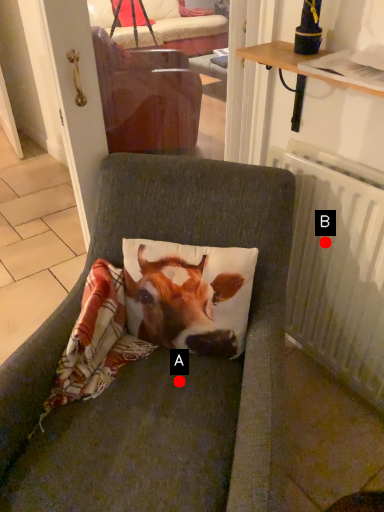
Question: Two points are circled on the image, labeled by A and B beside each circle. Among these points, which one is nearest to the camera?

Choices:
 (A) A is closer
 (B) B is closer

Answer: (A)